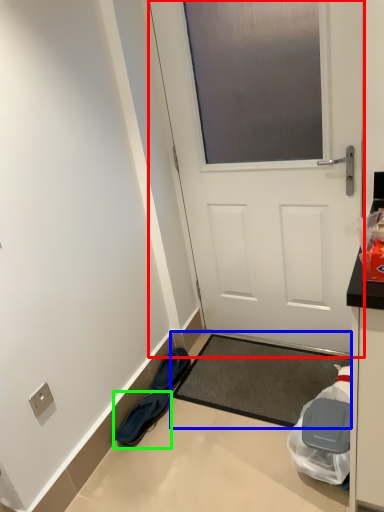
Question: Estimate the real-world distances between objects in this image. Which object is farther from door (highlighted by a red box), doormat (highlighted by a blue box) or footwear (highlighted by a green box)?

Choices:
 (A) doormat
 (B) footwear

Answer: (B)